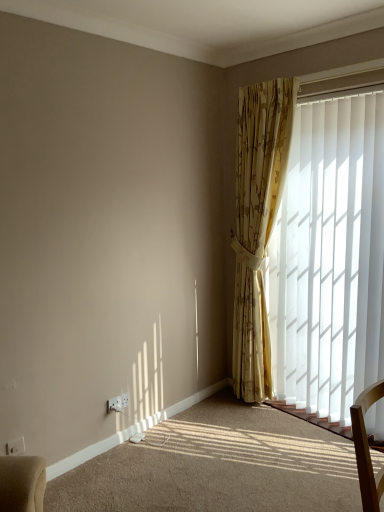
Question: Relative to white plastic window frame at upper right, is white plastic electric outlet at lower left, positioned as the 2th electric outlet in front-to-back order, in front or behind?

Choices:
 (A) front
 (B) behind

Answer: (B)

Question: Is white plastic electric outlet at lower left, marked as the 1th electric outlet in a right-to-left arrangement, wider or thinner than white plastic window frame at upper right?

Choices:
 (A) wide
 (B) thin

Answer: (B)

Question: Which is nearer to the white vertical blinds at right?

Choices:
 (A) gold floral curtain at right
 (B) white plastic window frame at upper right
 (C) white plastic electric outlet at lower left, marked as the 2th electric outlet in a right-to-left arrangement
 (D) white plastic electric outlet at lower left, which is counted as the first electric outlet, starting from the back

Answer: (A)

Question: Estimate the real-world distances between objects in this image. Which object is closer to the gold floral curtain at right?

Choices:
 (A) white plastic electric outlet at lower left, placed as the first electric outlet when sorted from front to back
 (B) white plastic window frame at upper right
 (C) white plastic electric outlet at lower left, positioned as the 2th electric outlet in front-to-back order
 (D) white vertical blinds at right

Answer: (D)